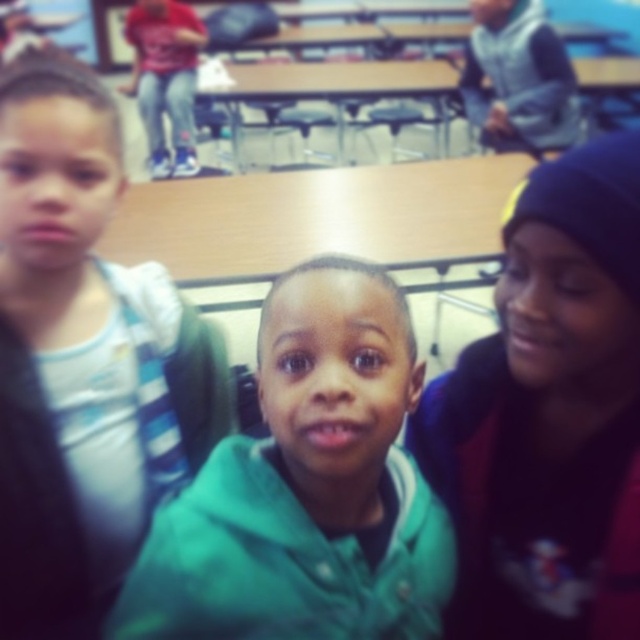
Based on the photo, you are standing at the center of the classroom and want to reach the two points marked in the image. Which point, point (132, 353) or point (378, 545), is closer to you?

Point (378, 545) is closer to you because it is in front of point (132, 353).

You are standing in the classroom scene and want to move from the point at coordinates point (x=525, y=321) to the point at coordinates point (x=118, y=605). Which direction should you move in to get closer to the second point?

To move from point (x=525, y=321) to point (x=118, y=605), you should move downward and to the right since point (x=118, y=605) is located at a lower and more rightward position compared to point (x=525, y=321).

You are standing in the classroom and want to take a closer look at the point at coordinates [90,420]. If your camera has a zoom range that can focus on objects within 40 inches, will you be able to zoom in clearly on that point?

The point at coordinates [90,420] is 37.79 inches away from the camera, which is within the 40 inches zoom range. Therefore, you can zoom in clearly on that point.